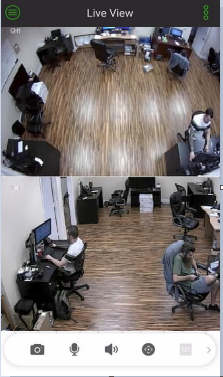
Find the location of `computer`. computer is located at coordinates (43, 229).